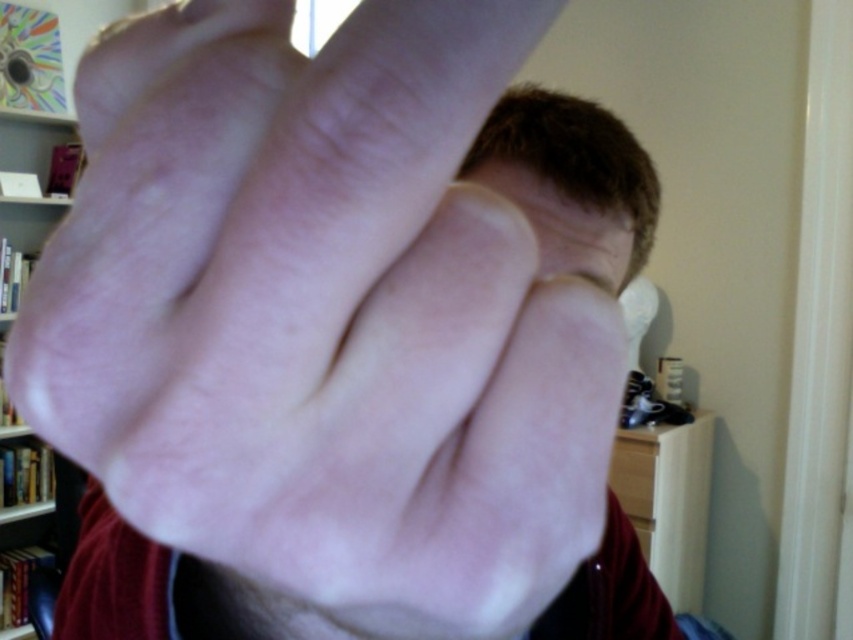
Question: Is smooth skin hand at center to the left of white wooden bookshelf at upper left from the viewer's perspective?

Choices:
 (A) no
 (B) yes

Answer: (A)

Question: Which point is farther from the camera taking this photo?

Choices:
 (A) (494, 157)
 (B) (422, 19)
 (C) (9, 147)

Answer: (C)

Question: From the image, what is the correct spatial relationship of smooth skin hand at center in relation to smooth skin at center?

Choices:
 (A) above
 (B) below

Answer: (B)

Question: Estimate the real-world distances between objects in this image. Which object is farther from the smooth skin at center?

Choices:
 (A) smooth skin hand at center
 (B) white wooden bookshelf at upper left

Answer: (B)

Question: Can you confirm if smooth skin hand at center is positioned below smooth skin at center?

Choices:
 (A) yes
 (B) no

Answer: (A)

Question: Which object is farther from the camera taking this photo?

Choices:
 (A) white wooden bookshelf at upper left
 (B) smooth skin hand at center
 (C) smooth skin at center

Answer: (A)